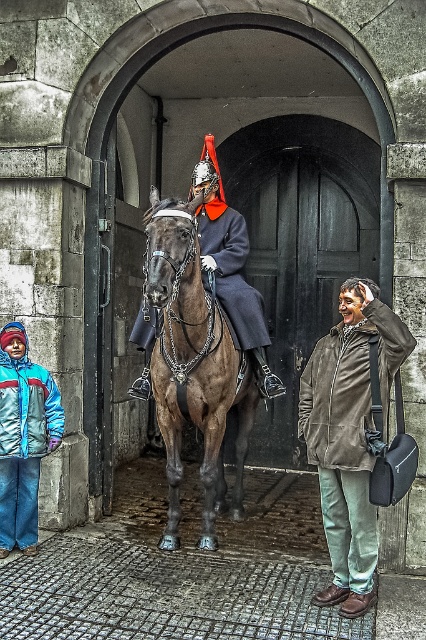
Based on the photo, who is positioned more to the right, brown glossy horse at center or brown leather jacket at lower right?

Positioned to the right is brown leather jacket at lower right.

Does brown glossy horse at center appear on the left side of brown leather jacket at lower right?

Correct, you'll find brown glossy horse at center to the left of brown leather jacket at lower right.

Where is `brown glossy horse at center`? The width and height of the screenshot is (426, 640). brown glossy horse at center is located at coordinates (192, 365).

The height and width of the screenshot is (640, 426). I want to click on brown glossy horse at center, so click(192, 365).

Who is taller, brown leather jacket at lower right or shiny black uniform at center?

shiny black uniform at center is taller.

Consider the image. Is brown leather jacket at lower right above shiny black uniform at center?

Incorrect, brown leather jacket at lower right is not positioned above shiny black uniform at center.

Is point (360, 572) farther from camera compared to point (203, 276)?

That is False.

In order to click on brown leather jacket at lower right in this screenshot , I will do `click(348, 435)`.

Who is shorter, brown glossy horse at center or shiny black uniform at center?

shiny black uniform at center

Is brown glossy horse at center to the left of shiny black uniform at center from the viewer's perspective?

Yes, brown glossy horse at center is to the left of shiny black uniform at center.

You are a GUI agent. You are given a task and a screenshot of the screen. Output one action in this format:
    pyautogui.click(x=<x>, y=<y>)
    Task: Click on the brown glossy horse at center
    
    Given the screenshot: What is the action you would take?
    pyautogui.click(x=192, y=365)